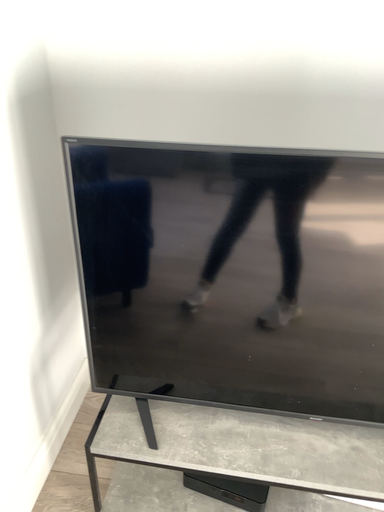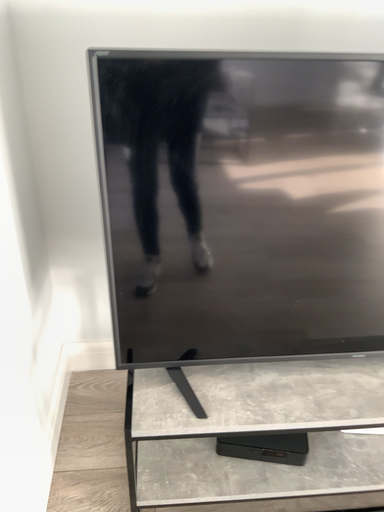
Question: Which way did the camera rotate in the video?

Choices:
 (A) rotated right
 (B) rotated left

Answer: (A)